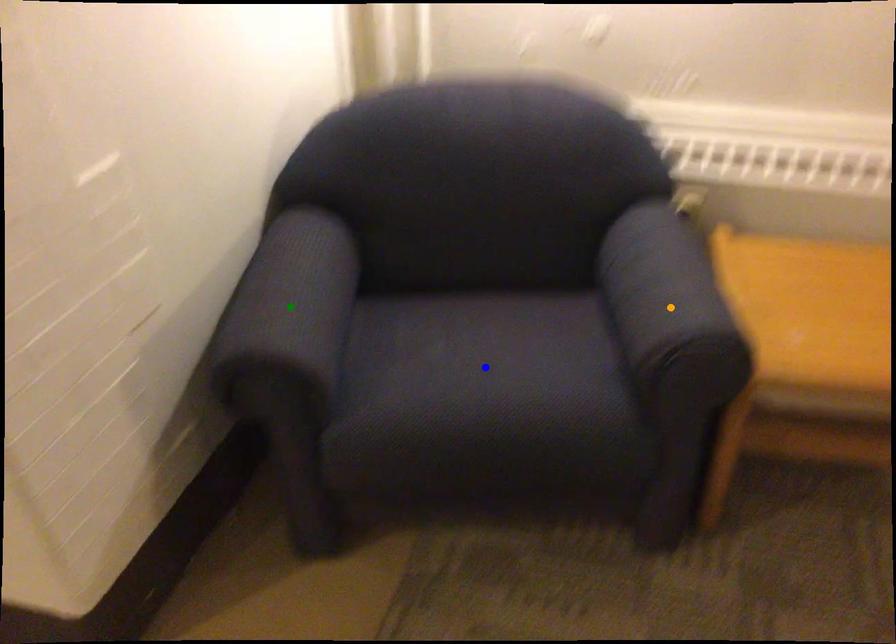
Order these from nearest to farthest:
orange point
blue point
green point

green point < blue point < orange point